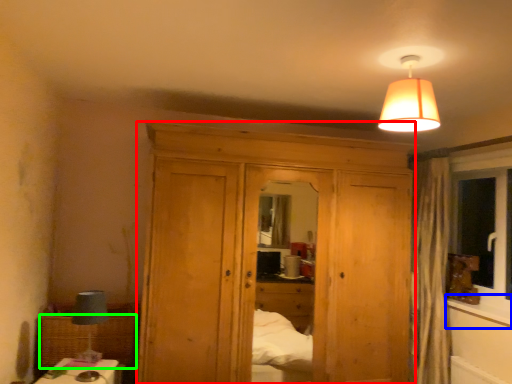
Question: Estimate the real-world distances between objects in this image. Which object is farther from dresser (highlighted by a red box), window sill (highlighted by a blue box) or picnic basket (highlighted by a green box)?

Choices:
 (A) window sill
 (B) picnic basket

Answer: (A)